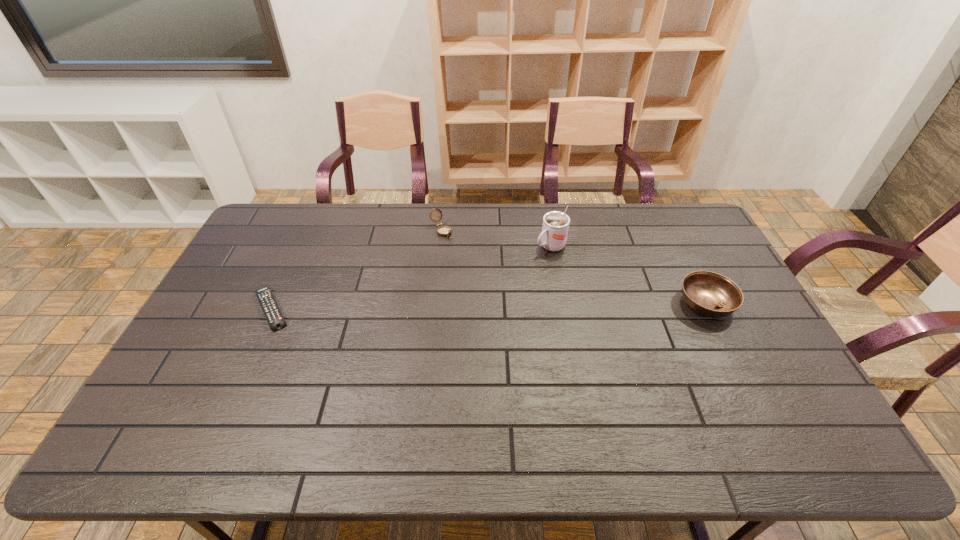
Where is `blank space located 0.100m on the face of the compass`? The image size is (960, 540). blank space located 0.100m on the face of the compass is located at coordinates (462, 254).

In order to click on free region located on the side with the handle of the third object from left to right in this screenshot , I will do `click(477, 293)`.

Find the location of `free region located 0.240m on the side with the handle of the third object from left to right`. free region located 0.240m on the side with the handle of the third object from left to right is located at coordinates (489, 285).

Identify the location of vacant space located 0.350m on the side with the handle of the third object from left to right. (462, 302).

Image resolution: width=960 pixels, height=540 pixels. I want to click on compass present at the far edge, so click(x=444, y=231).

At what (x,y) coordinates should I click in order to perform the action: click on cup positioned at the far edge. Please return your answer as a coordinate pair (x, y). This screenshot has width=960, height=540. Looking at the image, I should click on (555, 227).

Image resolution: width=960 pixels, height=540 pixels. Identify the location of object situated at the left edge. (271, 310).

The image size is (960, 540). Identify the location of object that is at the right edge. (710, 294).

In the image, there is a desktop. At what (x,y) coordinates should I click in order to perform the action: click on free region at the far edge. Please return your answer as a coordinate pair (x, y). Looking at the image, I should click on (348, 237).

Identify the location of vacant space at the near edge. This screenshot has height=540, width=960. 723,390.